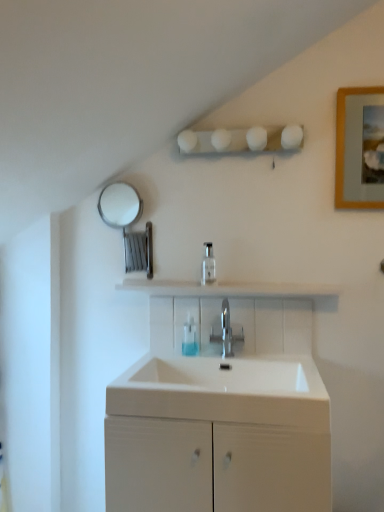
Find the location of a particular element. empty space that is to the right of translucent plastic soap dispenser at center is located at coordinates (235, 354).